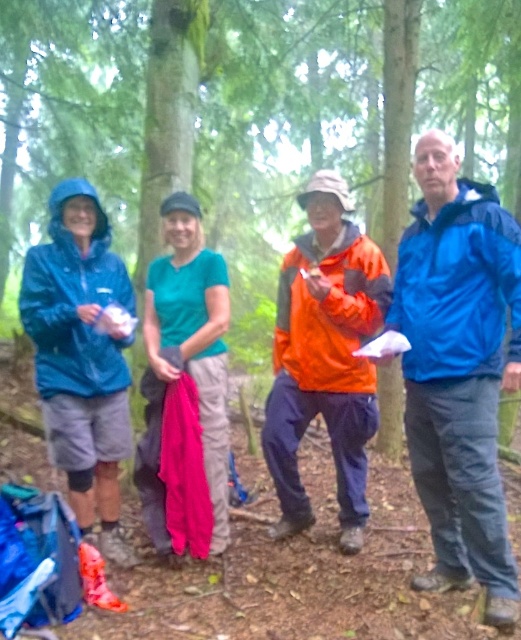
You are a photographer trying to capture a group photo of the blue smooth jacket at right and the orange waterproof jacket at center. Which jacket should you position closer to the camera to make them appear the same height in the photo?

The blue smooth jacket at right is much taller than the orange waterproof jacket at center. To make them appear the same height in the photo, you should position the orange waterproof jacket at center closer to the camera than the blue smooth jacket at right.

You are a hiker who wants to place your orange waterproof jacket at center on a flat surface. The green matte tree at center is in your way. Can you move the jacket to the left of the tree?

The green matte tree at center is positioned on the right side of orange waterproof jacket at center, meaning the jacket is already to the left of the tree. Therefore, you don not need to move it.